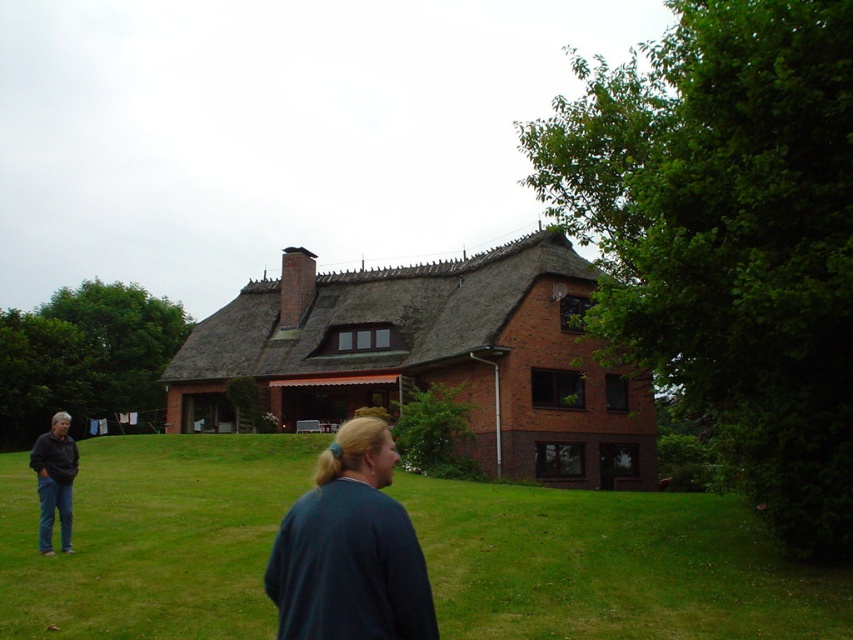
Can you confirm if green grass at lower left is smaller than dark blue sweater at center?

Actually, green grass at lower left might be larger than dark blue sweater at center.

This screenshot has width=853, height=640. Identify the location of green grass at lower left. (612, 566).